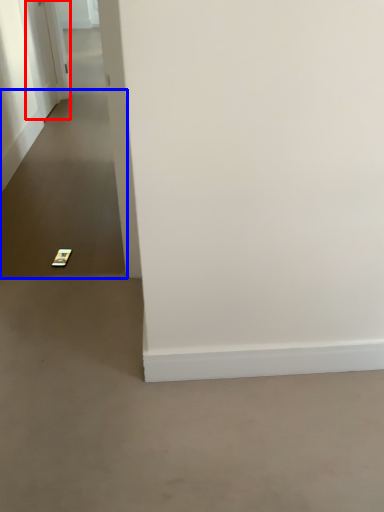
Question: Which point is closer to the camera, door (highlighted by a red box) or path (highlighted by a blue box)?

Choices:
 (A) door
 (B) path

Answer: (B)